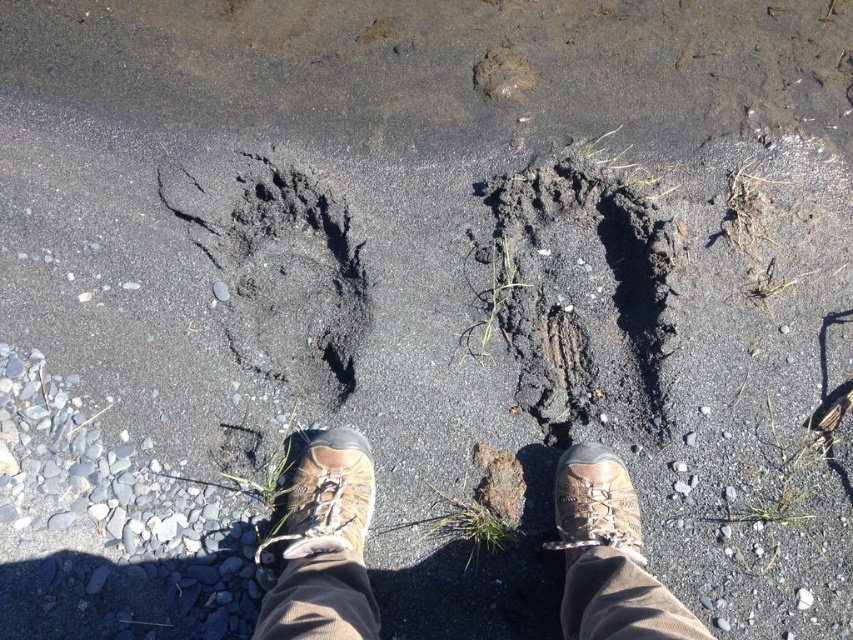
You are a hiker who notices two sets of footprints near your boots. The scene has brown leather shoes at center and brown leather shoe at center. Which one is positioned lower?

The brown leather shoes at center is positioned lower than the brown leather shoe at center.

You are a hiker who just noticed the brown leather shoes at center. You see two large animal footprints in front of them. Based on their position, can you determine if the footprints were made before or after the shoes were placed there?

The brown leather shoes at center are located at point (x=323, y=545). Since the footprints are in front of the shoes, it suggests that the footprints were likely made before the shoes were placed there, as the animal would have walked through the area before the hiker arrived.